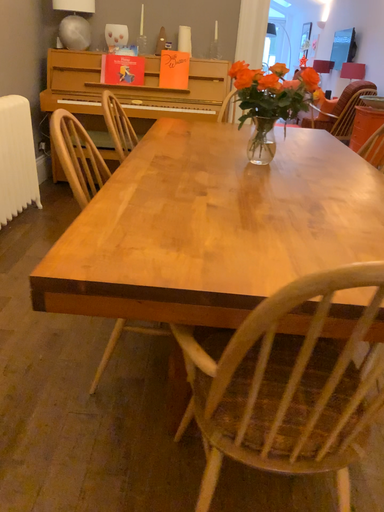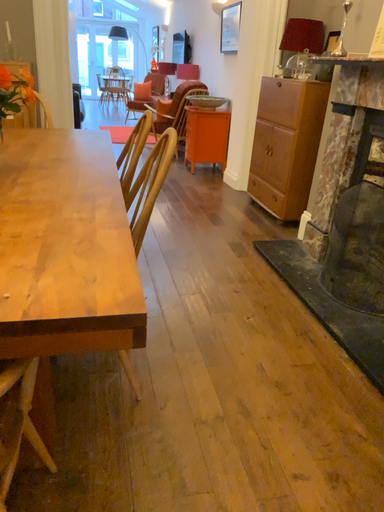
Question: Which way did the camera rotate in the video?

Choices:
 (A) rotated right
 (B) rotated left

Answer: (A)